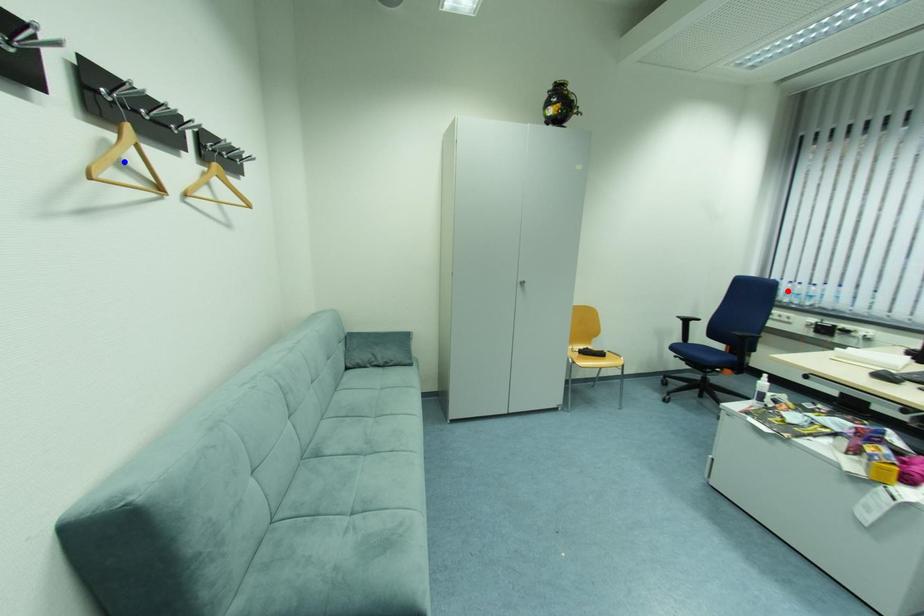
Question: Which of the two points in the image is closer to the camera?

Choices:
 (A) Blue point is closer.
 (B) Red point is closer.

Answer: (A)